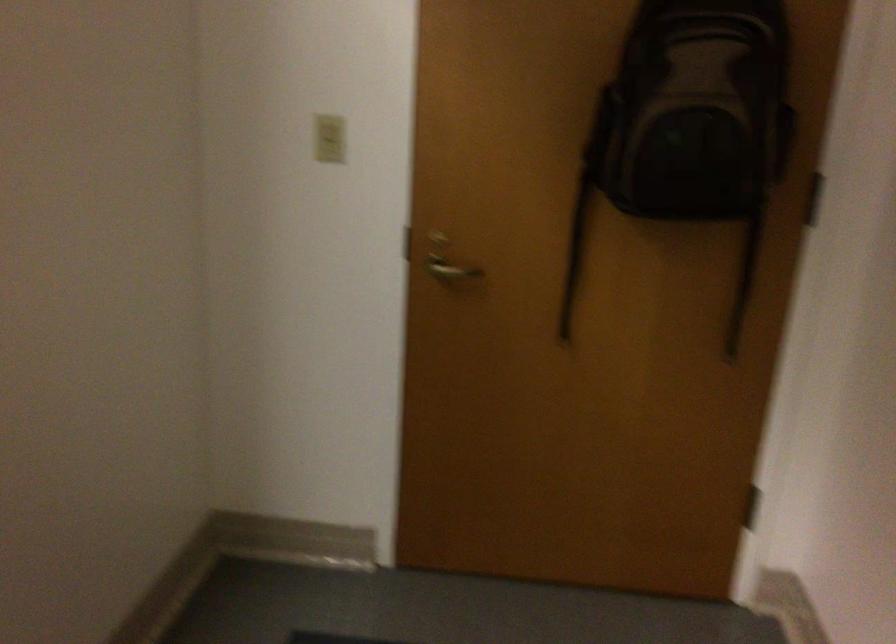
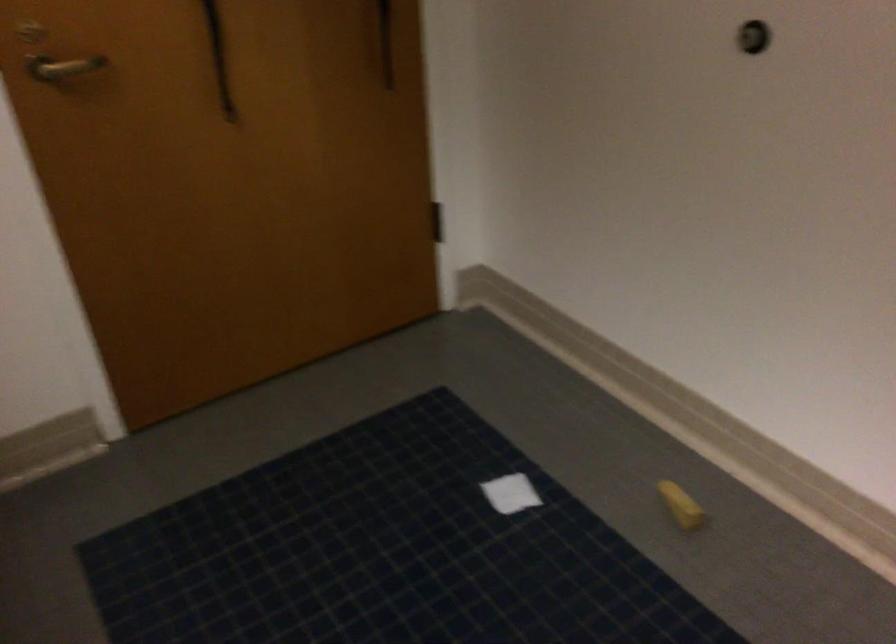
In the second image, find the point that corresponds to (x=567, y=290) in the first image.

(219, 58)